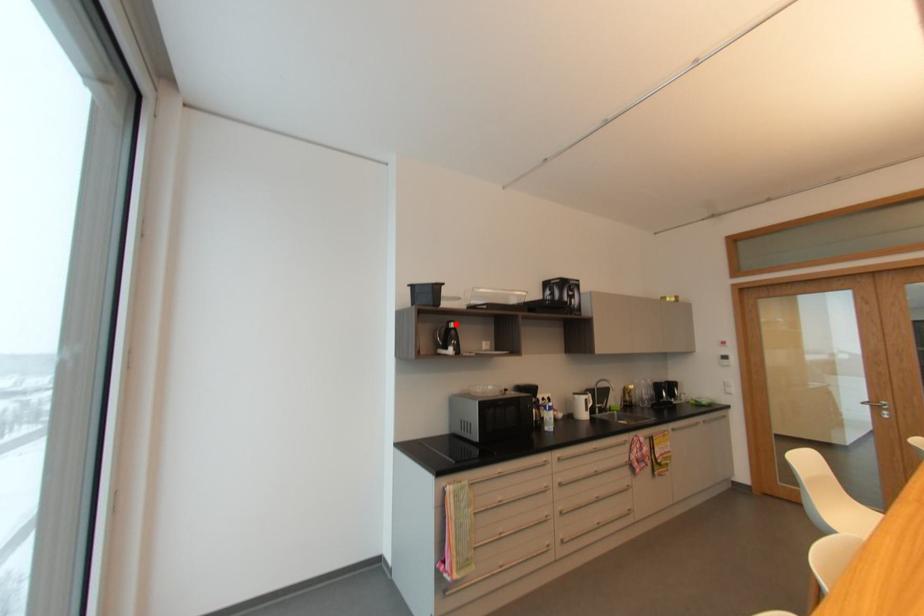
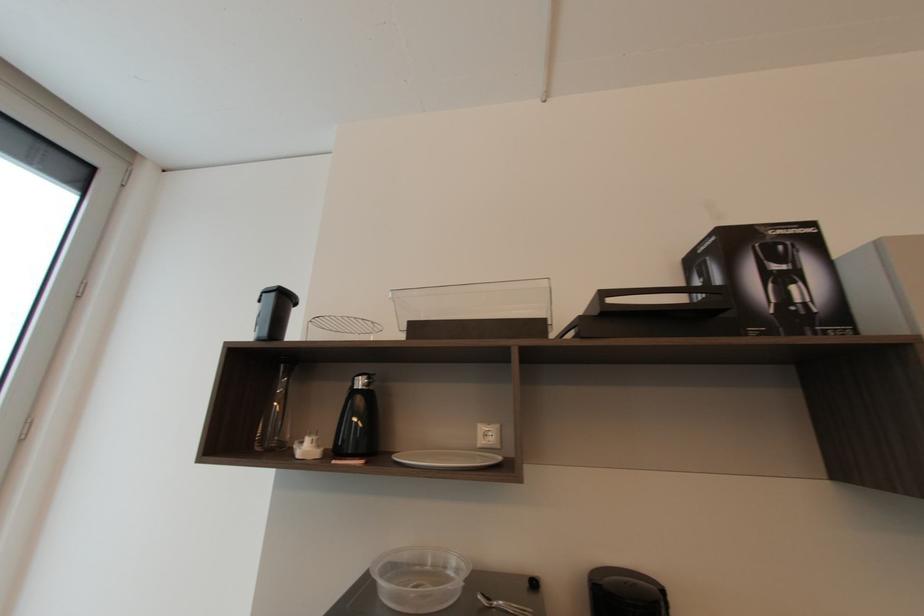
Find the pixel in the second image that matches the highlighted location in the first image.

(362, 384)